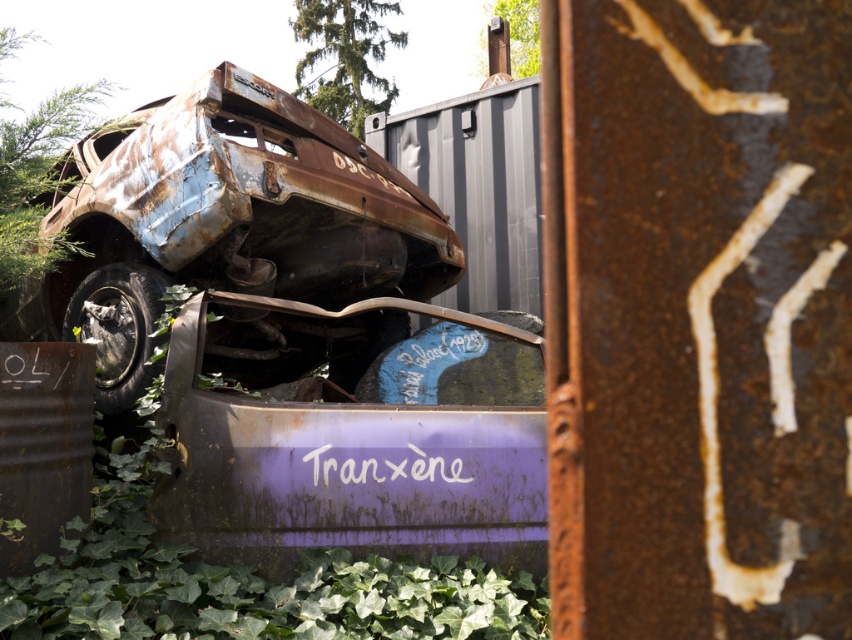
You are standing at the point labeled point (223,224). What object are you standing on?

You are standing on the rusty metal car at center.

You are standing 15 feet away from the abandoned vehicle. If you move forward 1 foot, will the point at coordinates point [355,237] become closer to you?

The distance of point [355,237] from viewer is 16.19 feet. Moving forward 1 foot would reduce the distance to 15.19 feet, so yes, the point at coordinates point [355,237] would become closer to you.

You are standing at the point marked by the coordinates point (118, 330). What object are you currently standing on?

The point (118, 330) is on the rusty metal tire at lower left.